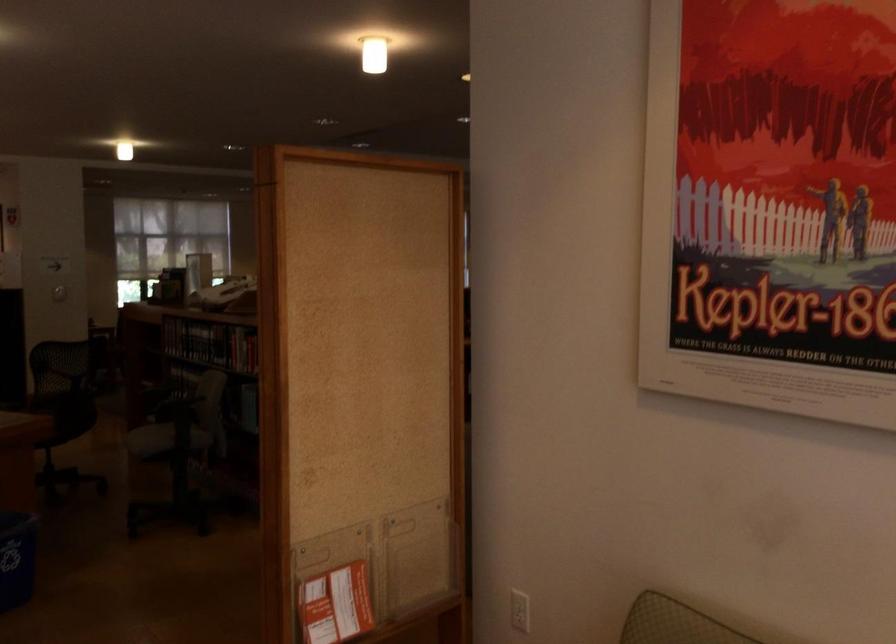
This screenshot has height=644, width=896. Describe the element at coordinates (151, 439) in the screenshot. I see `a chair sitting surface` at that location.